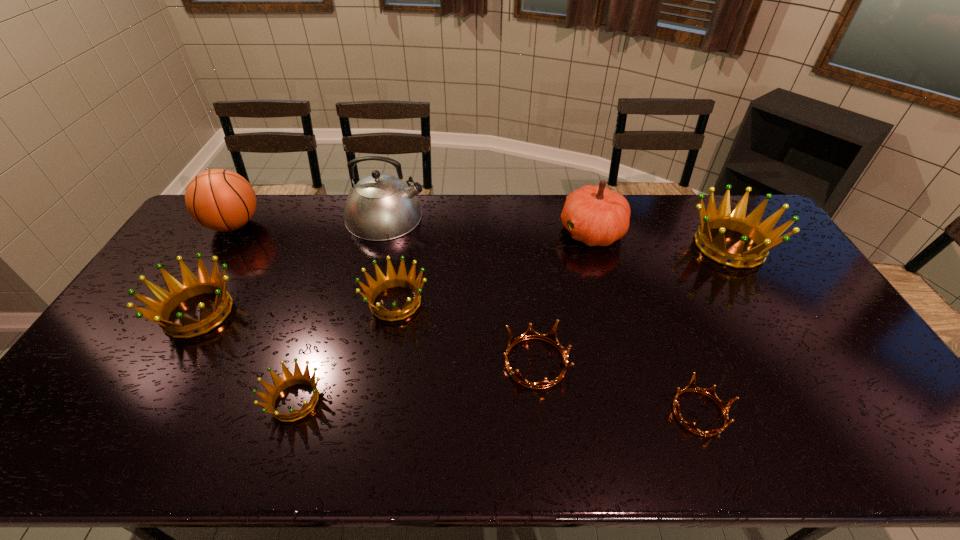
The width and height of the screenshot is (960, 540). In order to click on vacant area between the basketball and the kettle in this screenshot , I will do `click(310, 221)`.

The width and height of the screenshot is (960, 540). Identify the location of vacant region between the third golden crown from right to left and the third biggest golden crown. (346, 352).

I want to click on free space between the rightmost crown and the pink pumpkin, so click(660, 239).

At what (x,y) coordinates should I click in order to perform the action: click on free space between the fourth crown from right to left and the left gold crown. Please return your answer as a coordinate pair (x, y). Image resolution: width=960 pixels, height=540 pixels. Looking at the image, I should click on (466, 332).

Locate an element on the screen. This screenshot has width=960, height=540. free space between the kettle and the smaller gold crown is located at coordinates (542, 315).

Find the location of a particular element. This screenshot has height=540, width=960. free space between the fourth shortest crown and the kettle is located at coordinates (391, 259).

Identify the location of free point between the nearest golden crown and the kettle. (340, 309).

Choose which object is the sixth nearest neighbor to the pink pumpkin. Please provide its 2D coordinates. Your answer should be formatted as a tuple, i.e. [(x, y)], where the tuple contains the x and y coordinates of a point satisfying the conditions above.

[(289, 379)]

Point out which object is positioned as the third nearest to the pink pumpkin. Please provide its 2D coordinates. Your answer should be formatted as a tuple, i.e. [(x, y)], where the tuple contains the x and y coordinates of a point satisfying the conditions above.

[(392, 279)]

What are the coordinates of `the fourth closest crown to the right gold crown` in the screenshot? It's located at (289, 379).